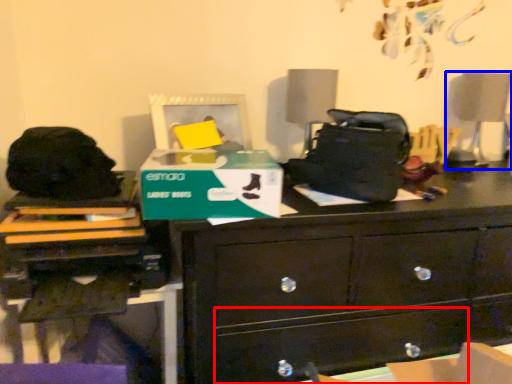
Question: Which object is further to the camera taking this photo, drawer (highlighted by a red box) or swivel chair (highlighted by a blue box)?

Choices:
 (A) drawer
 (B) swivel chair

Answer: (B)